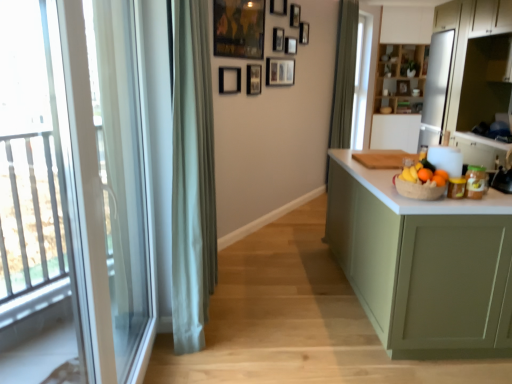
At what (x,y) coordinates should I click in order to perform the action: click on free space in front of orange matte at right, which is the 2th orange in left-to-right order. Please return your answer as a coordinate pair (x, y). Looking at the image, I should click on (439, 200).